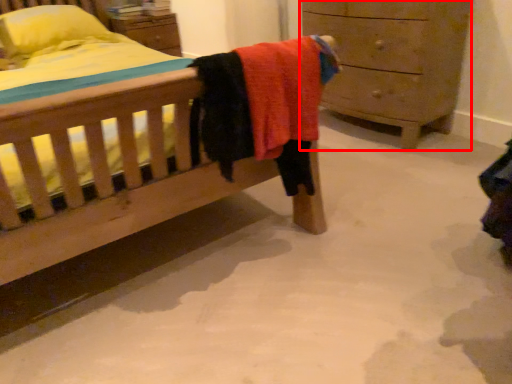
Question: Considering the relative positions of chest of drawers (annotated by the red box) and pillow in the image provided, where is chest of drawers (annotated by the red box) located with respect to the staircase?

Choices:
 (A) left
 (B) right

Answer: (B)